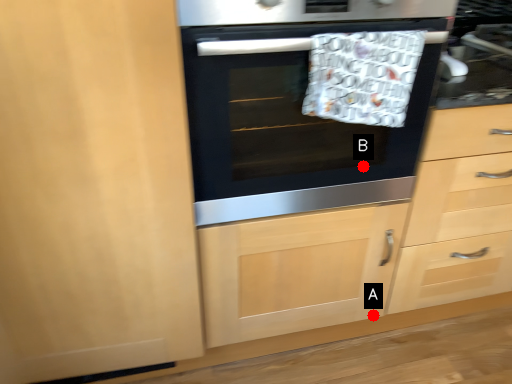
Question: Two points are circled on the image, labeled by A and B beside each circle. Which of the following is the closest to the observer?

Choices:
 (A) A is closer
 (B) B is closer

Answer: (B)